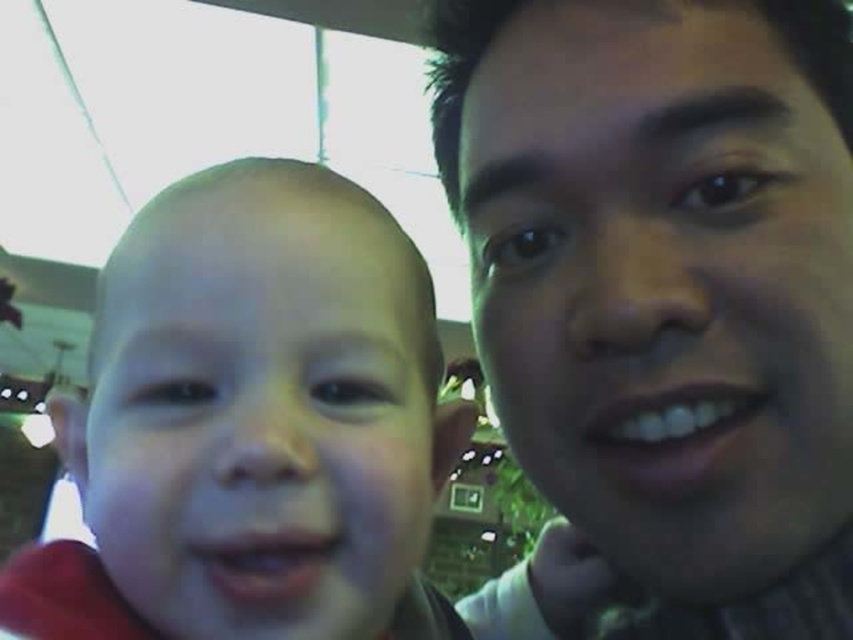
Question: Does smooth skin face at center have a greater width compared to smooth skin baby at center?

Choices:
 (A) no
 (B) yes

Answer: (B)

Question: Which point appears farthest from the camera in this image?

Choices:
 (A) (815, 76)
 (B) (405, 280)

Answer: (A)

Question: Can you confirm if smooth skin face at center is positioned above smooth skin baby at center?

Choices:
 (A) no
 (B) yes

Answer: (B)

Question: Among these objects, which one is nearest to the camera?

Choices:
 (A) smooth skin baby at center
 (B) smooth skin face at center

Answer: (A)

Question: Among these objects, which one is nearest to the camera?

Choices:
 (A) smooth skin face at center
 (B) smooth skin baby at center

Answer: (B)

Question: Is smooth skin face at center smaller than smooth skin baby at center?

Choices:
 (A) no
 (B) yes

Answer: (A)